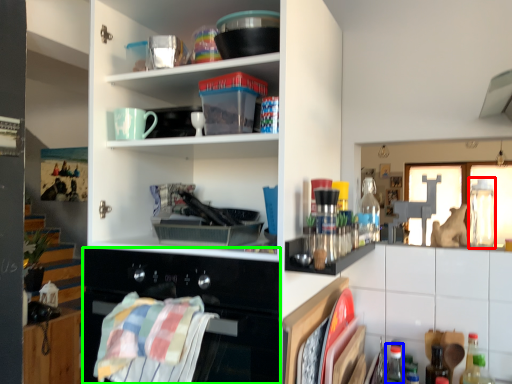
Question: Which object is positioned closest to bottle (highlighted by a red box)? Select from bottle (highlighted by a blue box) and oven (highlighted by a green box).

Choices:
 (A) bottle
 (B) oven

Answer: (A)